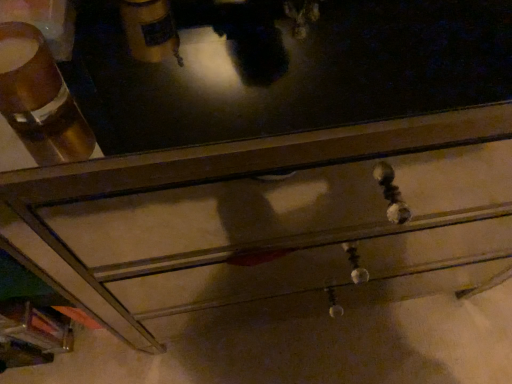
Question: Considering the positions of point (22, 94) and point (510, 120), is point (22, 94) closer or farther from the camera than point (510, 120)?

Choices:
 (A) farther
 (B) closer

Answer: (B)

Question: Is matte brown cup at upper left inside or outside of metallic drawer at center?

Choices:
 (A) inside
 (B) outside

Answer: (B)

Question: Considering their positions, is matte brown cup at upper left located in front of or behind metallic drawer at center?

Choices:
 (A) behind
 (B) front

Answer: (B)

Question: From a real-world perspective, is metallic drawer at center above or below matte brown cup at upper left?

Choices:
 (A) below
 (B) above

Answer: (A)

Question: Considering the positions of metallic drawer at center and matte brown cup at upper left in the image, is metallic drawer at center taller or shorter than matte brown cup at upper left?

Choices:
 (A) short
 (B) tall

Answer: (B)

Question: Based on their sizes in the image, would you say metallic drawer at center is bigger or smaller than matte brown cup at upper left?

Choices:
 (A) small
 (B) big

Answer: (B)

Question: Would you say metallic drawer at center is inside or outside matte brown cup at upper left?

Choices:
 (A) inside
 (B) outside

Answer: (B)